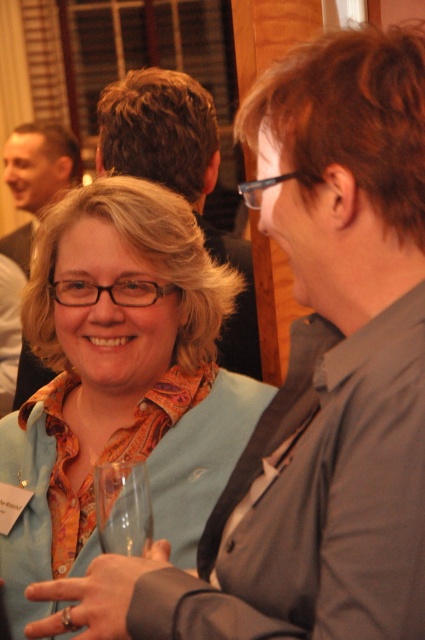
You are standing at the point closest to the camera in the image. Which of the two points, point (x=47, y=202) or point (x=99, y=476), is farther away from you?

Point (x=47, y=202) is behind point (x=99, y=476), so it is farther away from you.

You are at a social gathering and want to grab a drink from the transparent glass at lower left. However, there is a person wearing a matte black shirt at upper left blocking your path. Can you walk around them to reach the glass?

The matte black shirt at upper left is to the left of the transparent glass at lower left, so you can walk around to the right side of the matte black shirt at upper left to reach the transparent glass at lower left.